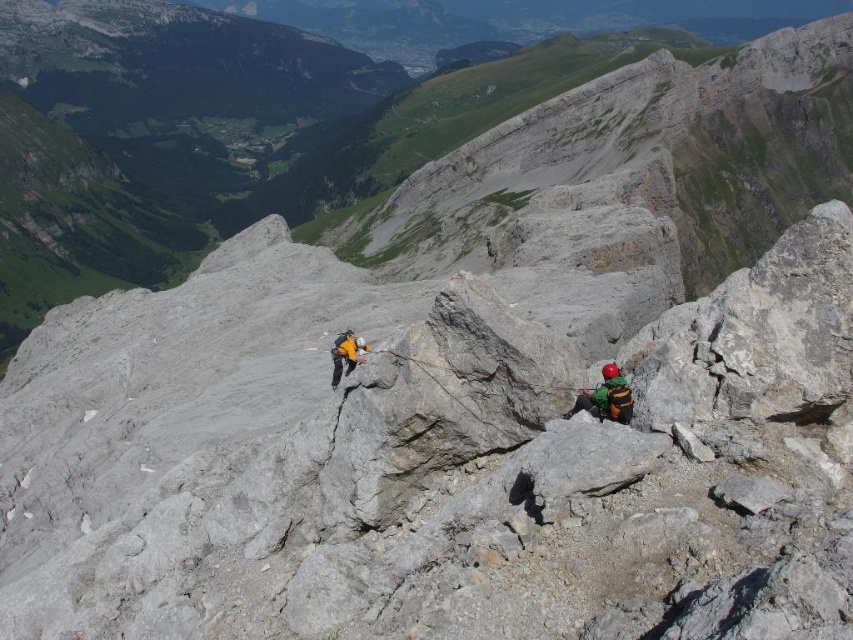
Consider the image. You are planning to carry a backpack with straps that are 2 inches wide. You see the green fabric harness at center and the yellow fabric helmet at center in the image. Which of these items can your backpack straps fit through without tearing the fabric?

The green fabric harness at center is thinner than the yellow fabric helmet at center, so the backpack straps can fit through the green fabric harness at center without tearing the fabric.

You are a drone operator trying to capture aerial footage of the mountain climbers. You have two points marked on your screen corresponding to their positions. The first point is labeled as point (379, 353) and the second as point (601, 397). Which point should you focus on to ensure the climber is closer to the camera?

Point (379, 353) is further to the camera than point (601, 397), so focusing on point (379, 353) will ensure the climber is closer to the camera.

You are a climber looking at the mountain scene. You see the ropetexturedrope at center and the yellow fabric helmet at center. Which object is closer to you?

The ropetexturedrope at center is in front of the yellow fabric helmet at center, so it is closer to you.